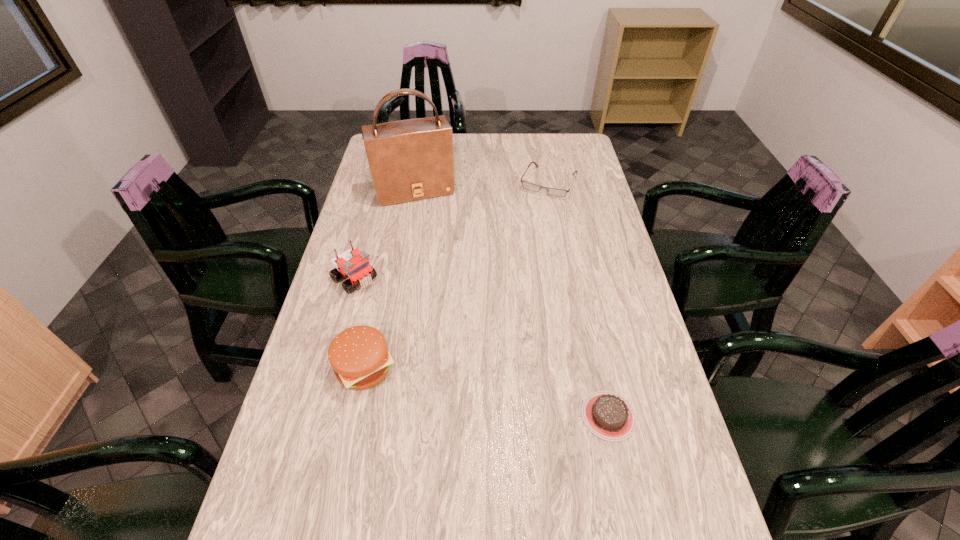
This screenshot has height=540, width=960. I want to click on vacant position located 0.070m on the front flap of the shoulder bag, so [427, 218].

In order to click on vacant space situated on the front-facing side of the fourth shortest object in this screenshot , I will do `click(447, 357)`.

The height and width of the screenshot is (540, 960). I want to click on free space located 0.340m on the front-facing side of the fourth shortest object, so click(447, 357).

Where is `free space located 0.230m on the front-facing side of the fourth shortest object`? The image size is (960, 540). free space located 0.230m on the front-facing side of the fourth shortest object is located at coordinates (420, 334).

You are a GUI agent. You are given a task and a screenshot of the screen. Output one action in this format:
    pyautogui.click(x=<x>, y=<y>)
    Task: Click on the vacant position located 0.330m on the front-facing side of the fourth tallest object
    
    Given the screenshot: What is the action you would take?
    pyautogui.click(x=511, y=256)

Identify the location of vacant area located 0.230m on the front-facing side of the fourth tallest object. Image resolution: width=960 pixels, height=540 pixels. (520, 237).

Locate an element on the screen. The width and height of the screenshot is (960, 540). vacant area situated on the front-facing side of the fourth tallest object is located at coordinates (532, 215).

Find the location of `hamburger positioned at the left edge`. hamburger positioned at the left edge is located at coordinates (359, 356).

At what (x,y) coordinates should I click in order to perform the action: click on shoulder bag situated at the left edge. Please return your answer as a coordinate pair (x, y). The width and height of the screenshot is (960, 540). Looking at the image, I should click on (409, 160).

Identify the location of Lego positioned at the left edge. The image size is (960, 540). (354, 264).